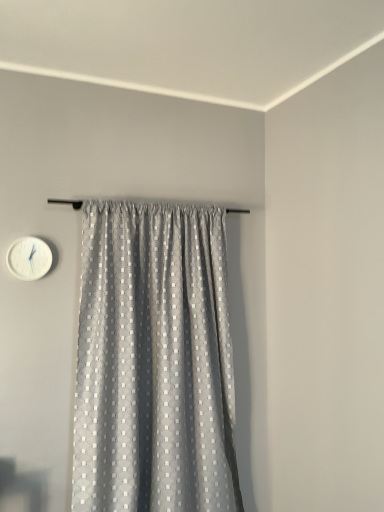
Question: Should I look upward or downward to see white plastic wall clock at upper left?

Choices:
 (A) up
 (B) down

Answer: (B)

Question: Is the position of white plastic wall clock at upper left less distant than that of gray textured curtain at center?

Choices:
 (A) yes
 (B) no

Answer: (B)

Question: Considering the relative sizes of white plastic wall clock at upper left and gray textured curtain at center in the image provided, is white plastic wall clock at upper left smaller than gray textured curtain at center?

Choices:
 (A) yes
 (B) no

Answer: (A)

Question: Can gray textured curtain at center be found inside white plastic wall clock at upper left?

Choices:
 (A) yes
 (B) no

Answer: (B)

Question: Is white plastic wall clock at upper left next to gray textured curtain at center and touching it?

Choices:
 (A) no
 (B) yes

Answer: (A)

Question: Is white plastic wall clock at upper left shorter than gray textured curtain at center?

Choices:
 (A) yes
 (B) no

Answer: (A)

Question: Can you confirm if white plastic wall clock at upper left is wider than gray textured curtain at center?

Choices:
 (A) yes
 (B) no

Answer: (B)

Question: Can you confirm if gray textured curtain at center is wider than white plastic wall clock at upper left?

Choices:
 (A) yes
 (B) no

Answer: (A)

Question: Considering the relative sizes of gray textured curtain at center and white plastic wall clock at upper left in the image provided, is gray textured curtain at center taller than white plastic wall clock at upper left?

Choices:
 (A) no
 (B) yes

Answer: (B)

Question: Considering the relative sizes of gray textured curtain at center and white plastic wall clock at upper left in the image provided, is gray textured curtain at center bigger than white plastic wall clock at upper left?

Choices:
 (A) no
 (B) yes

Answer: (B)

Question: Would you consider gray textured curtain at center to be distant from white plastic wall clock at upper left?

Choices:
 (A) no
 (B) yes

Answer: (A)

Question: Is white plastic wall clock at upper left completely or partially inside gray textured curtain at center?

Choices:
 (A) no
 (B) yes

Answer: (A)

Question: From a real-world perspective, is gray textured curtain at center located beneath white plastic wall clock at upper left?

Choices:
 (A) no
 (B) yes

Answer: (B)

Question: Is white plastic wall clock at upper left spatially inside gray textured curtain at center, or outside of it?

Choices:
 (A) outside
 (B) inside

Answer: (A)